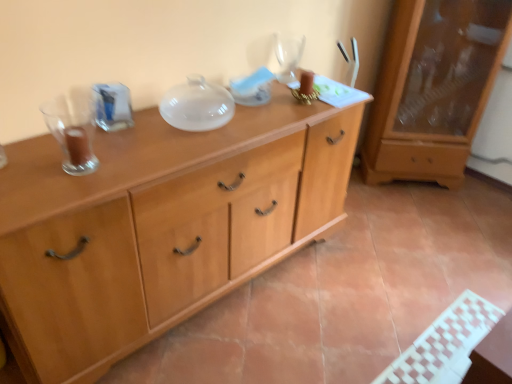
Where is `vacant area that lies between light wood cabinet at center and matte wooden cabinet at right`? vacant area that lies between light wood cabinet at center and matte wooden cabinet at right is located at coordinates (354, 235).